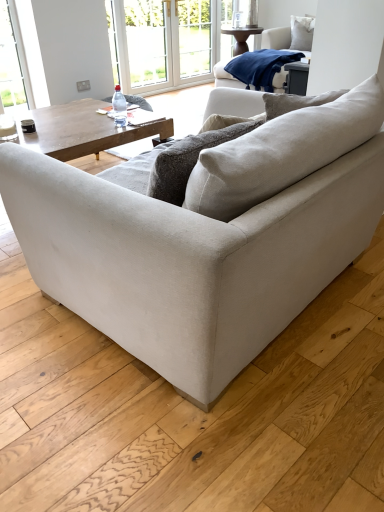
Question: From the image's perspective, would you say transparent plastic window screen at upper center is positioned over navy blue fleece blanket at upper right?

Choices:
 (A) no
 (B) yes

Answer: (B)

Question: Does transparent plastic window screen at upper center have a lesser width compared to navy blue fleece blanket at upper right?

Choices:
 (A) no
 (B) yes

Answer: (B)

Question: Does transparent plastic window screen at upper center have a greater height compared to navy blue fleece blanket at upper right?

Choices:
 (A) no
 (B) yes

Answer: (B)

Question: Is transparent plastic window screen at upper center closer to camera compared to navy blue fleece blanket at upper right?

Choices:
 (A) no
 (B) yes

Answer: (A)

Question: Is transparent plastic window screen at upper center completely or partially outside of navy blue fleece blanket at upper right?

Choices:
 (A) no
 (B) yes

Answer: (B)

Question: In terms of height, does white plastic window frame at upper center look taller or shorter compared to transparent plastic bottle at center?

Choices:
 (A) short
 (B) tall

Answer: (B)

Question: Considering the positions of point (157, 44) and point (115, 117), is point (157, 44) closer or farther from the camera than point (115, 117)?

Choices:
 (A) closer
 (B) farther

Answer: (B)

Question: Is white plastic window frame at upper center in front of or behind transparent plastic bottle at center in the image?

Choices:
 (A) behind
 (B) front

Answer: (A)

Question: From the image's perspective, is white plastic window frame at upper center above or below transparent plastic bottle at center?

Choices:
 (A) below
 (B) above

Answer: (B)

Question: From their relative heights in the image, would you say white glossy coffee cup at upper left is taller or shorter than white glass screen door at upper center?

Choices:
 (A) tall
 (B) short

Answer: (B)

Question: In the image, is white glossy coffee cup at upper left positioned in front of or behind white glass screen door at upper center?

Choices:
 (A) behind
 (B) front

Answer: (B)

Question: Is white glossy coffee cup at upper left spatially inside white glass screen door at upper center, or outside of it?

Choices:
 (A) outside
 (B) inside

Answer: (A)

Question: Is point (6, 119) closer or farther from the camera than point (183, 10)?

Choices:
 (A) closer
 (B) farther

Answer: (A)

Question: In the image, is transparent plastic bottle at center on the left side or the right side of white soft cushion at upper right?

Choices:
 (A) left
 (B) right

Answer: (A)

Question: Do you think transparent plastic bottle at center is within white soft cushion at upper right, or outside of it?

Choices:
 (A) inside
 (B) outside

Answer: (B)